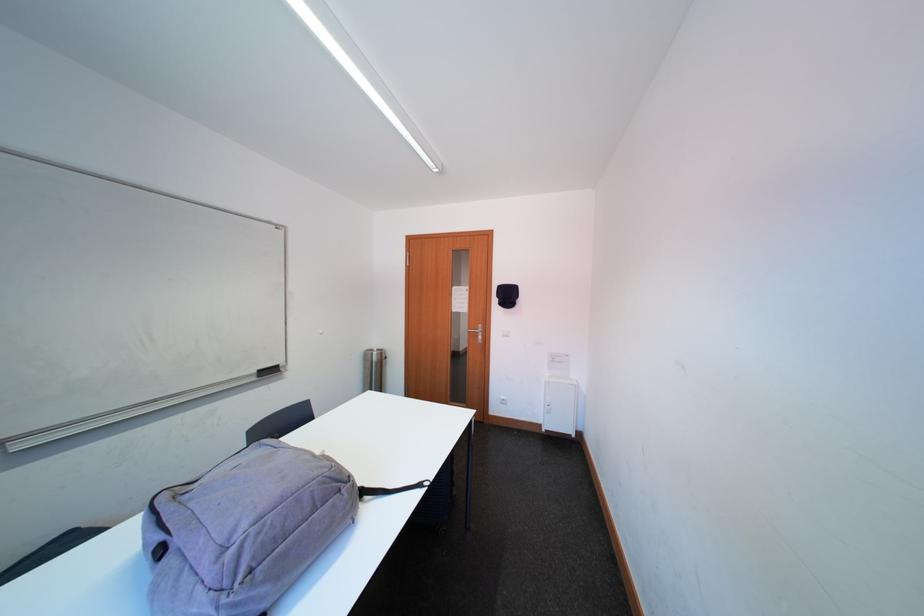
Image resolution: width=924 pixels, height=616 pixels. Describe the element at coordinates (560, 406) in the screenshot. I see `the white cup dispenser` at that location.